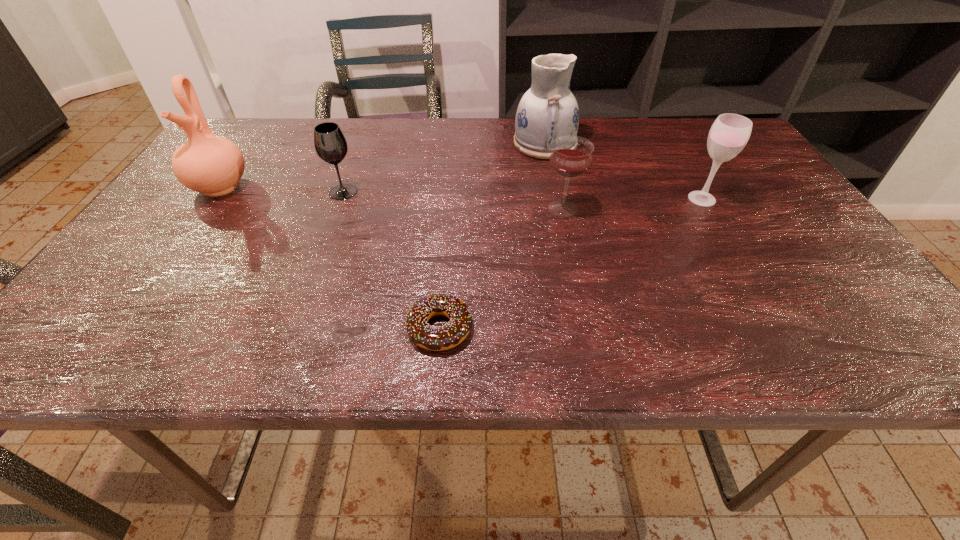
I want to click on free spot located on the left of the right pottery, so click(437, 143).

Identify the location of blank space located on the front of the rightmost wineglass. The width and height of the screenshot is (960, 540). (777, 327).

Where is `vacant space located 0.340m on the left of the second object from left to right`? vacant space located 0.340m on the left of the second object from left to right is located at coordinates (186, 192).

Locate an element on the screen. The height and width of the screenshot is (540, 960). vacant position located 0.310m on the back of the second wineglass from right to left is located at coordinates (546, 132).

What are the coordinates of `vacant area situated on the left of the third object from left to right` in the screenshot? It's located at (361, 328).

Where is `object present at the far edge`? Image resolution: width=960 pixels, height=540 pixels. object present at the far edge is located at coordinates (548, 110).

The height and width of the screenshot is (540, 960). What are the coordinates of `object present at the near edge` in the screenshot? It's located at (432, 338).

The width and height of the screenshot is (960, 540). Find the location of `object situated at the left edge`. object situated at the left edge is located at coordinates (212, 165).

The height and width of the screenshot is (540, 960). Identify the location of free region at the far edge of the desktop. (587, 135).

I want to click on free region at the near edge of the desktop, so click(349, 331).